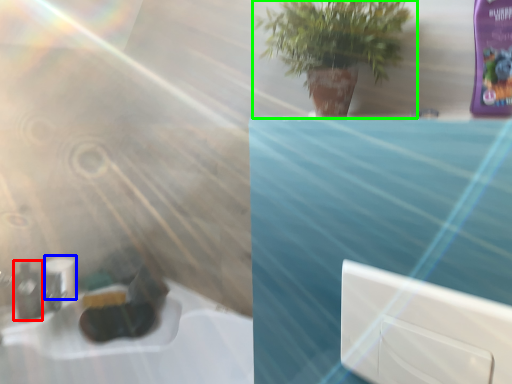
Question: Based on their relative distances, which object is nearer to mouthwash (highlighted by a red box)? Choose from toilet paper (highlighted by a blue box) and houseplant (highlighted by a green box).

Choices:
 (A) toilet paper
 (B) houseplant

Answer: (A)